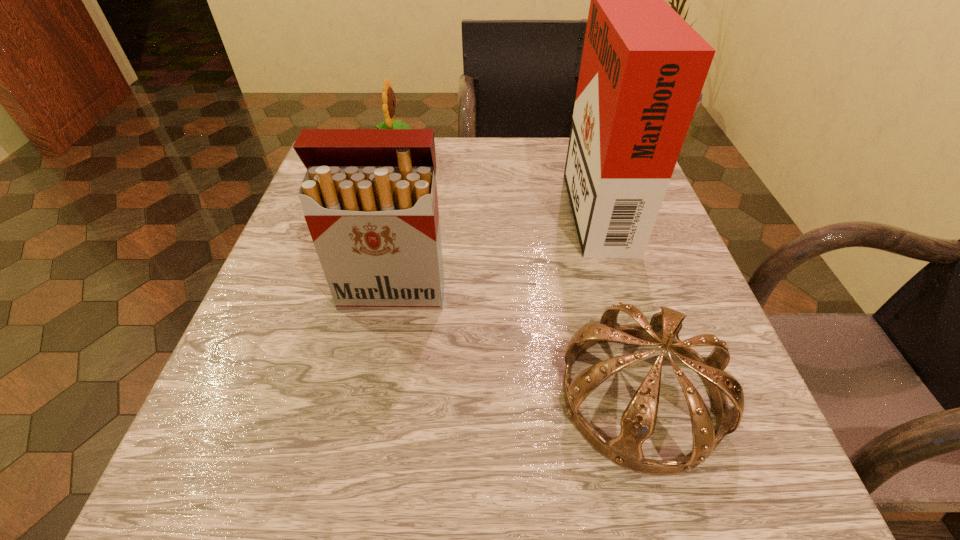
What are the coordinates of `object located in the far left corner section of the desktop` in the screenshot? It's located at (388, 97).

You are a GUI agent. You are given a task and a screenshot of the screen. Output one action in this format:
    pyautogui.click(x=<x>, y=<y>)
    Task: Click on the object at the far right corner
    This screenshot has height=540, width=960.
    Given the screenshot: What is the action you would take?
    coord(643,67)

At what (x,y) coordinates should I click in order to perform the action: click on object at the near right corner. Please return your answer as a coordinate pair (x, y). This screenshot has height=540, width=960. Looking at the image, I should click on 638,421.

In order to click on free space at the far edge of the desktop in this screenshot , I will do `click(496, 173)`.

Find the location of a particular element. The width and height of the screenshot is (960, 540). vacant space at the near edge of the desktop is located at coordinates (537, 438).

This screenshot has height=540, width=960. I want to click on vacant space at the left edge of the desktop, so tap(347, 310).

What are the coordinates of `vacant region at the near right corner of the desktop` in the screenshot? It's located at (748, 451).

The height and width of the screenshot is (540, 960). I want to click on blank region between the shortest object and the nearer cigarette case, so click(x=516, y=345).

At what (x,y) coordinates should I click in order to perform the action: click on unoccupied area between the shortest object and the second shortest object. Please return your answer as a coordinate pair (x, y). The width and height of the screenshot is (960, 540). Looking at the image, I should click on (518, 275).

Locate an element on the screen. vacant area that lies between the taller cigarette case and the sunflower is located at coordinates (496, 178).